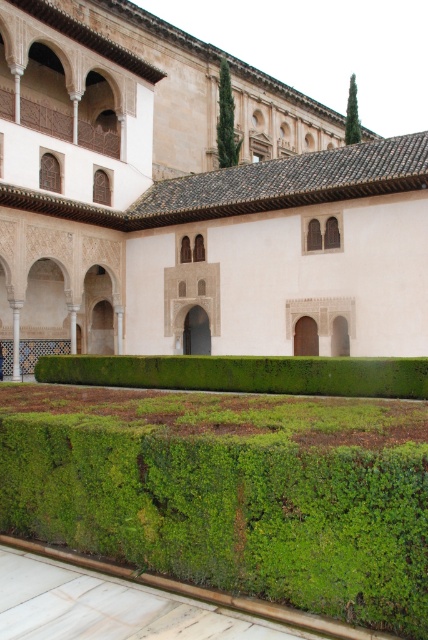
You are a tourist standing in the Alhambra garden and see two points marked in the image. Which point, point (308, 518) or point (321, 378), is closer to you?

Point (308, 518) is closer to the camera than point (321, 378).

You are a tourist standing in the Alhambra garden. You see the green mossy hedge at center and the green leafy hedge at center. Which hedge is closer to you?

The green mossy hedge at center is closer to you because it is in front of the green leafy hedge at center.

You are a tourist standing at the entrance of the Alhambra gardens. You want to take a photo of the green mossy hedge at center without any obstructions. Considering your camera has a maximum zoom of 5 meters, can you capture the hedge clearly without moving closer?

The green mossy hedge at center is 8.37 meters away from the viewer. Since your camera can only zoom up to 5 meters, you cannot capture the hedge clearly without moving closer.